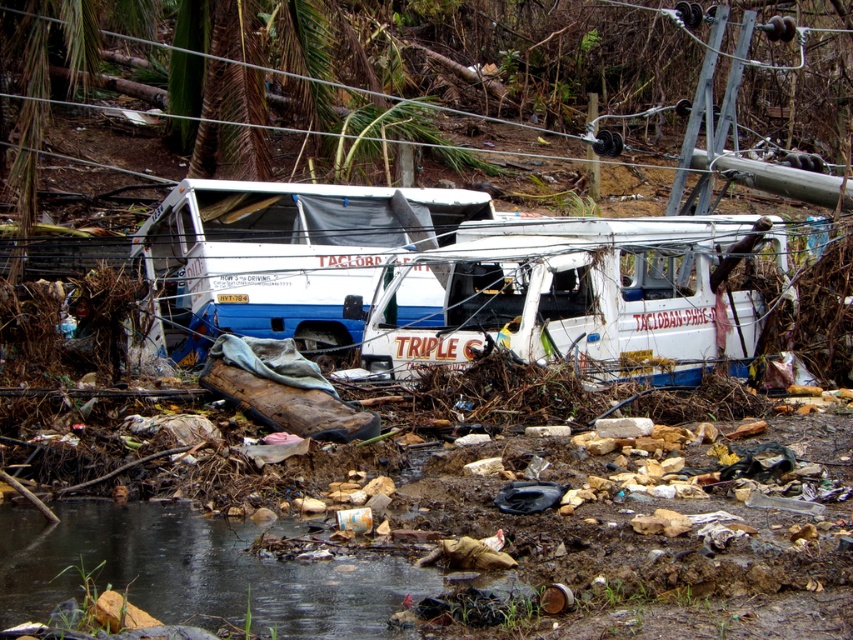
This screenshot has width=853, height=640. I want to click on white matte van at center, so click(x=581, y=294).

Between point (695, 294) and point (229, 541), which one is positioned behind?

The point (695, 294) is more distant.

Find the location of a particular element. Image resolution: width=853 pixels, height=640 pixels. white matte van at center is located at coordinates (581, 294).